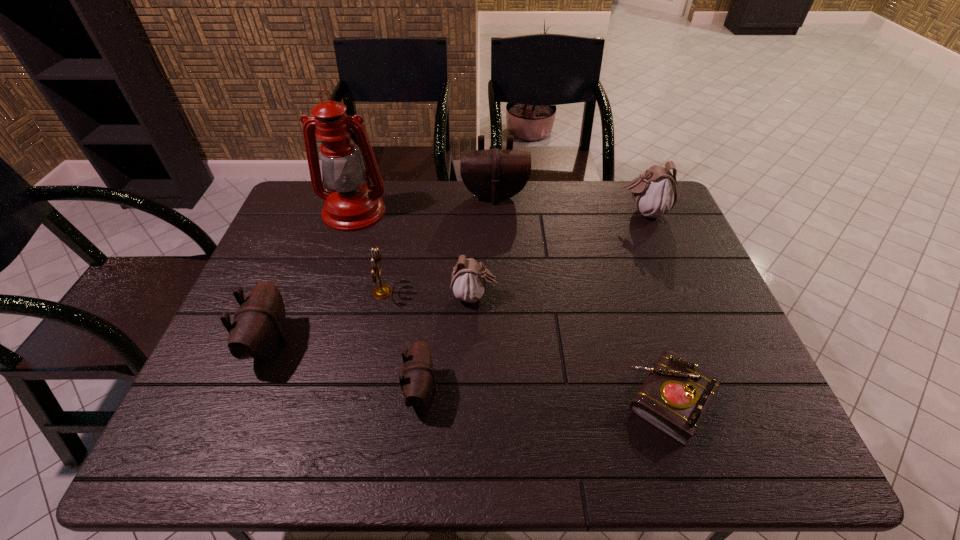
Locate an element on the screen. oil lamp is located at coordinates (351, 205).

Image resolution: width=960 pixels, height=540 pixels. I want to click on the rightmost brown pouch, so click(495, 174).

Locate an element on the screen. This screenshot has height=540, width=960. the farthest brown pouch is located at coordinates (495, 174).

Where is `the rightmost pouch`? the rightmost pouch is located at coordinates [x=655, y=192].

The width and height of the screenshot is (960, 540). I want to click on the farther white pouch, so click(655, 192).

You are a GUI agent. You are given a task and a screenshot of the screen. Output one action in this format:
    pyautogui.click(x=<x>, y=<y>)
    Task: Click on the gold candelabrum
    This screenshot has height=540, width=960.
    Given the screenshot: What is the action you would take?
    pyautogui.click(x=383, y=291)

At what (x,y) coordinates should I click in order to perform the action: click on the third object from left to right. Please return your answer as a coordinate pair (x, y). The image size is (960, 540). Looking at the image, I should click on (383, 291).

Where is `the second smallest brown pouch`? the second smallest brown pouch is located at coordinates (258, 330).

At what (x,y) coordinates should I click in order to perform the action: click on the leftmost brown pouch. Please return your answer as a coordinate pair (x, y). The width and height of the screenshot is (960, 540). Looking at the image, I should click on (258, 330).

The width and height of the screenshot is (960, 540). In order to click on the left white pouch in this screenshot , I will do `click(469, 280)`.